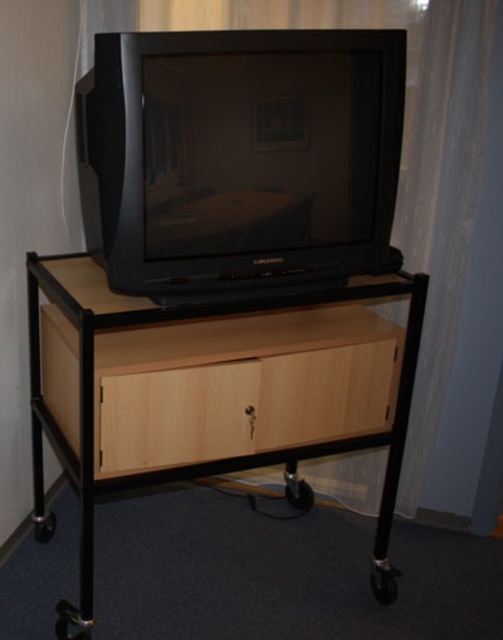
You are standing in front of the television stand and want to place a small plant between the two points labeled point [205,77] and point [123,448]. Which point should the plant be closer to if you want it to be nearer to the front of the stand?

The plant should be closer to point [123,448] because it is behind point [205,77], so placing the plant near point [123,448] would position it closer to the front of the stand.

You are standing in a room with a small wheeled television stand against the wall. On top of it is a CRT television. There is a point labeled at coordinate (x=242, y=156). What object is located at that point?

The point at coordinate (x=242, y=156) indicates the location of the black plastic television at center.